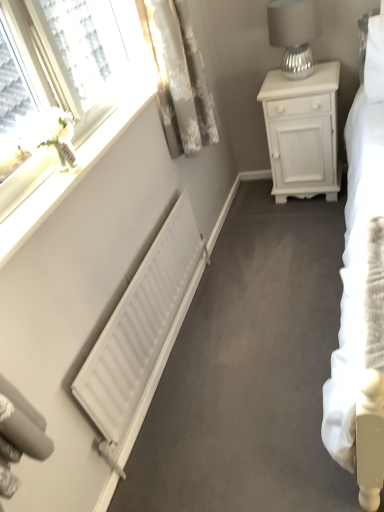
Question: Is white textured curtain at upper left taller than white matte radiator at lower left?

Choices:
 (A) no
 (B) yes

Answer: (B)

Question: Does white textured curtain at upper left contain white matte radiator at lower left?

Choices:
 (A) yes
 (B) no

Answer: (B)

Question: Is the depth of white textured curtain at upper left less than that of white matte radiator at lower left?

Choices:
 (A) no
 (B) yes

Answer: (A)

Question: Is white textured curtain at upper left facing towards white matte radiator at lower left?

Choices:
 (A) yes
 (B) no

Answer: (B)

Question: From a real-world perspective, is white textured curtain at upper left located higher than white matte radiator at lower left?

Choices:
 (A) no
 (B) yes

Answer: (B)

Question: From a real-world perspective, is white glossy window sill at upper left positioned above or below white textured curtain at upper left?

Choices:
 (A) below
 (B) above

Answer: (A)

Question: Based on their positions, is white glossy window sill at upper left located to the left or right of white textured curtain at upper left?

Choices:
 (A) right
 (B) left

Answer: (B)

Question: Considering the positions of point (125, 112) and point (180, 76), is point (125, 112) closer or farther from the camera than point (180, 76)?

Choices:
 (A) closer
 (B) farther

Answer: (A)

Question: Considering the positions of white glossy window sill at upper left and white textured curtain at upper left in the image, is white glossy window sill at upper left wider or thinner than white textured curtain at upper left?

Choices:
 (A) wide
 (B) thin

Answer: (B)

Question: From the image's perspective, is white matte radiator at lower left located above or below white matte nightstand at upper right?

Choices:
 (A) below
 (B) above

Answer: (A)

Question: Would you say white matte radiator at lower left is to the left or to the right of white matte nightstand at upper right in the picture?

Choices:
 (A) right
 (B) left

Answer: (B)

Question: Is white matte radiator at lower left in front of or behind white matte nightstand at upper right in the image?

Choices:
 (A) front
 (B) behind

Answer: (A)

Question: Do you think white matte radiator at lower left is within white matte nightstand at upper right, or outside of it?

Choices:
 (A) outside
 (B) inside

Answer: (A)

Question: Looking at their shapes, would you say white matte nightstand at upper right is wider or thinner than white textured curtain at upper left?

Choices:
 (A) wide
 (B) thin

Answer: (A)

Question: Is white matte nightstand at upper right situated inside white textured curtain at upper left or outside?

Choices:
 (A) inside
 (B) outside

Answer: (B)